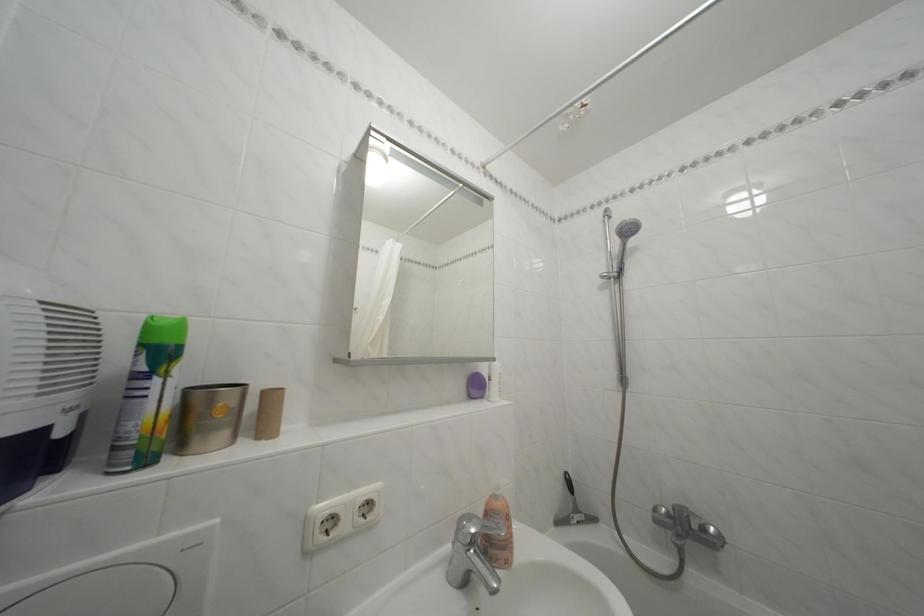
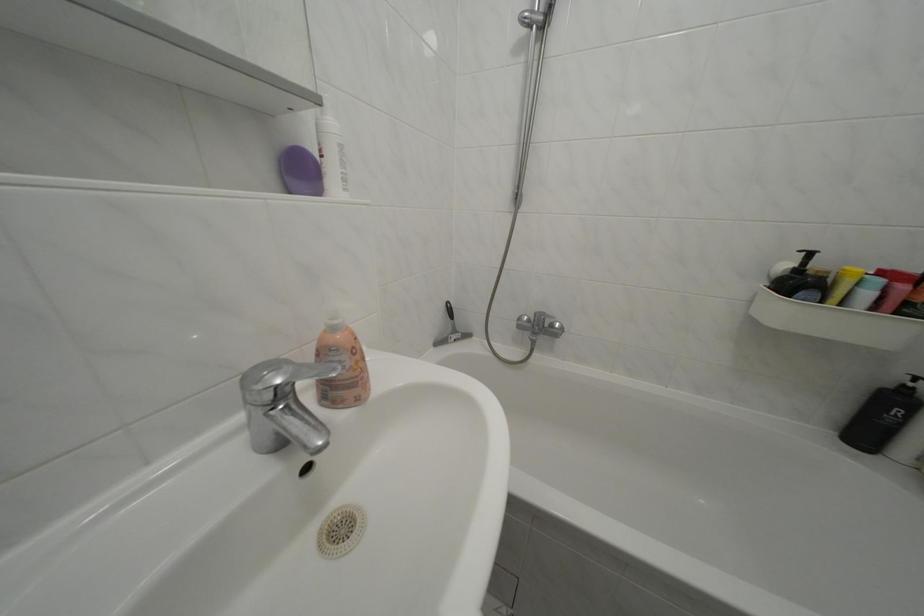
The images are taken continuously from a first-person perspective. In which direction is your viewpoint rotating?

The camera's rotation is toward right-down.